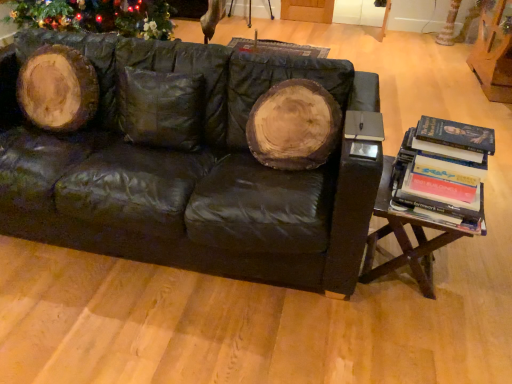
You are a GUI agent. You are given a task and a screenshot of the screen. Output one action in this format:
    pyautogui.click(x=<x>, y=<y>)
    Task: Click on the free space to the left of white textured tree trunk at upper right
    The width and height of the screenshot is (512, 384).
    Given the screenshot: What is the action you would take?
    pyautogui.click(x=425, y=46)